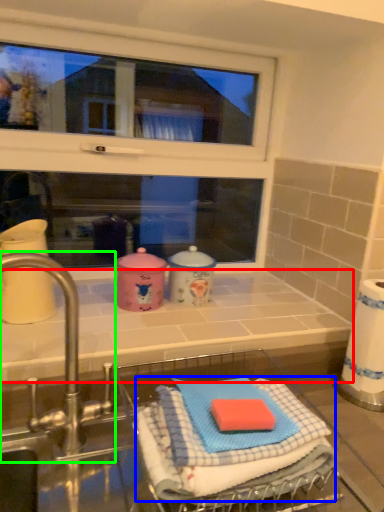
Question: Which is nearer to the counter top (highlighted by a red box)? bath towel (highlighted by a blue box) or tap (highlighted by a green box).

Choices:
 (A) bath towel
 (B) tap

Answer: (B)